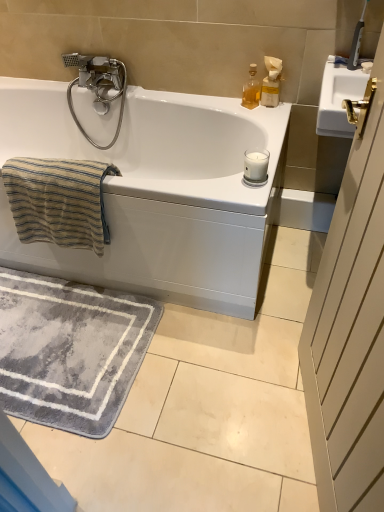
Identify the location of free spot to the left of white frosted glass candle at upper right. This screenshot has width=384, height=512. (215, 186).